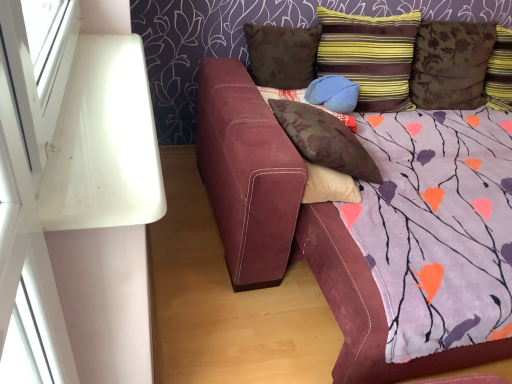
Question: Which direction should I rotate to look at brown suede pillow at upper center, the 5th pillow viewed from the right?

Choices:
 (A) right
 (B) left

Answer: (A)

Question: Does floral fabric pillow at upper right, the first pillow viewed from the right, have a larger size compared to striped velvet pillow at upper right, placed as the 2th pillow when sorted from right to left?

Choices:
 (A) yes
 (B) no

Answer: (B)

Question: Does floral fabric pillow at upper right, acting as the 5th pillow starting from the left, come behind striped velvet pillow at upper right, marked as the 4th pillow in a left-to-right arrangement?

Choices:
 (A) no
 (B) yes

Answer: (B)

Question: Is floral fabric pillow at upper right, acting as the 5th pillow starting from the left, thinner than striped velvet pillow at upper right, marked as the 4th pillow in a left-to-right arrangement?

Choices:
 (A) yes
 (B) no

Answer: (A)

Question: From the image's perspective, does floral fabric pillow at upper right, acting as the 5th pillow starting from the left, appear lower than striped velvet pillow at upper right, marked as the 4th pillow in a left-to-right arrangement?

Choices:
 (A) yes
 (B) no

Answer: (B)

Question: Does floral fabric pillow at upper right, acting as the 5th pillow starting from the left, have a lesser height compared to striped velvet pillow at upper right, marked as the 4th pillow in a left-to-right arrangement?

Choices:
 (A) no
 (B) yes

Answer: (B)

Question: Is floral fabric pillow at upper right, acting as the 5th pillow starting from the left, directly adjacent to striped velvet pillow at upper right, placed as the 2th pillow when sorted from right to left?

Choices:
 (A) no
 (B) yes

Answer: (A)

Question: Can you confirm if brown suede pillow at upper center, the 1th pillow viewed from the left, is thinner than brown suede pillow at center, which ranks as the second pillow in left-to-right order?

Choices:
 (A) no
 (B) yes

Answer: (B)

Question: From the image's perspective, is brown suede pillow at upper center, the 1th pillow viewed from the left, on top of brown suede pillow at center, which ranks as the second pillow in left-to-right order?

Choices:
 (A) no
 (B) yes

Answer: (B)

Question: Does brown suede pillow at upper center, the 5th pillow viewed from the right, have a greater height compared to brown suede pillow at center, which ranks as the second pillow in left-to-right order?

Choices:
 (A) yes
 (B) no

Answer: (A)

Question: Is brown suede pillow at center, which ranks as the second pillow in left-to-right order, located within brown suede pillow at upper center, the 1th pillow viewed from the left?

Choices:
 (A) no
 (B) yes

Answer: (A)

Question: Does brown suede pillow at upper center, the 5th pillow viewed from the right, have a lesser height compared to brown suede pillow at center, acting as the fourth pillow starting from the right?

Choices:
 (A) yes
 (B) no

Answer: (B)

Question: Can you confirm if brown suede pillow at upper center, the 1th pillow viewed from the left, is bigger than brown suede pillow at center, acting as the fourth pillow starting from the right?

Choices:
 (A) yes
 (B) no

Answer: (B)

Question: Considering the relative sizes of striped velvet pillow at upper right, marked as the 4th pillow in a left-to-right arrangement, and brown suede pillow at center, which ranks as the second pillow in left-to-right order, in the image provided, is striped velvet pillow at upper right, marked as the 4th pillow in a left-to-right arrangement, shorter than brown suede pillow at center, which ranks as the second pillow in left-to-right order,?

Choices:
 (A) yes
 (B) no

Answer: (B)